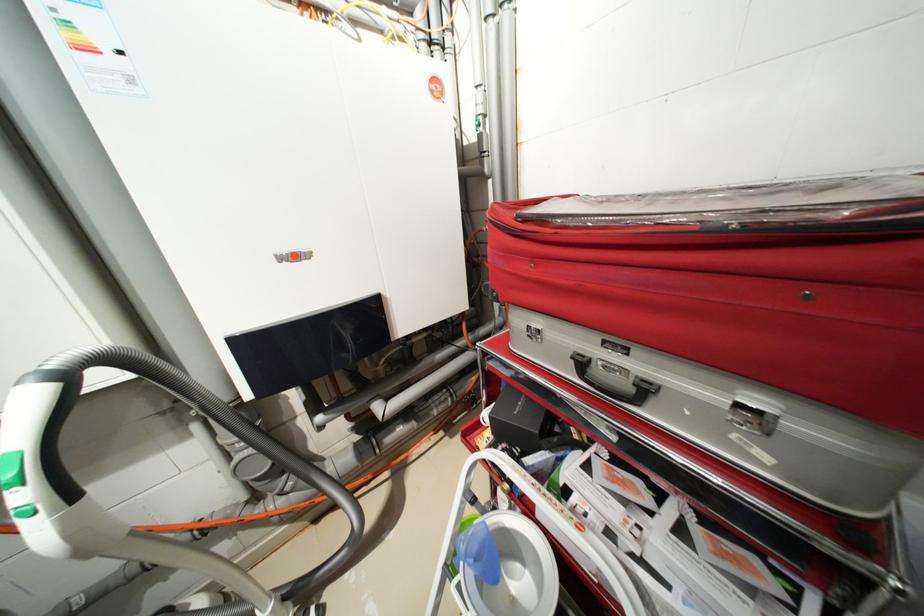
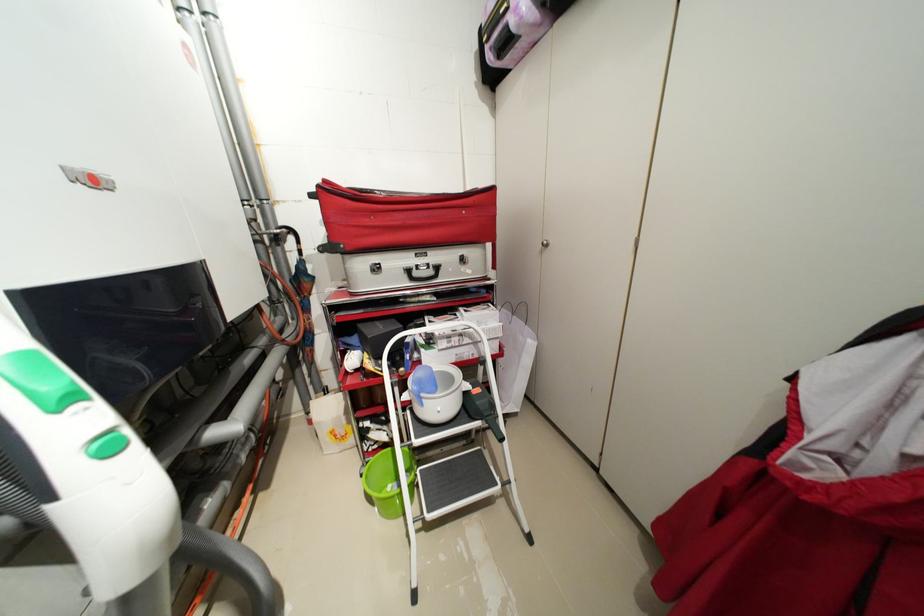
Question: How did the camera likely rotate?

Choices:
 (A) Left
 (B) Right
 (C) Up
 (D) Down

Answer: (B)